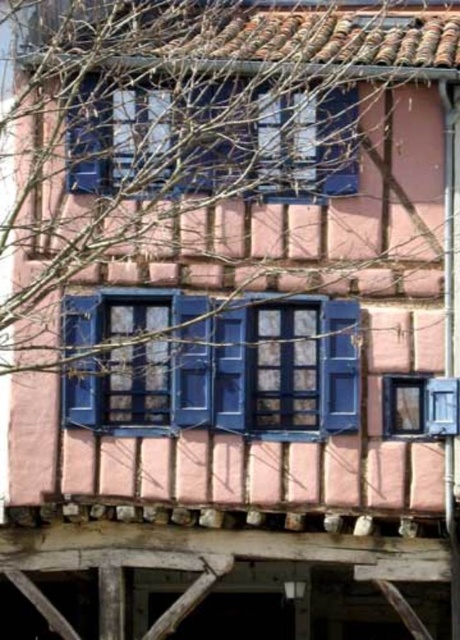
Can you confirm if matte blue shutters at center is positioned to the right of blue painted wood at upper center?

In fact, matte blue shutters at center is to the left of blue painted wood at upper center.

This screenshot has height=640, width=460. What do you see at coordinates (214, 364) in the screenshot?
I see `matte blue shutters at center` at bounding box center [214, 364].

Where is `matte blue shutters at center`? matte blue shutters at center is located at coordinates (214, 364).

Where is `matte blue shutters at center`? matte blue shutters at center is located at coordinates (214, 364).